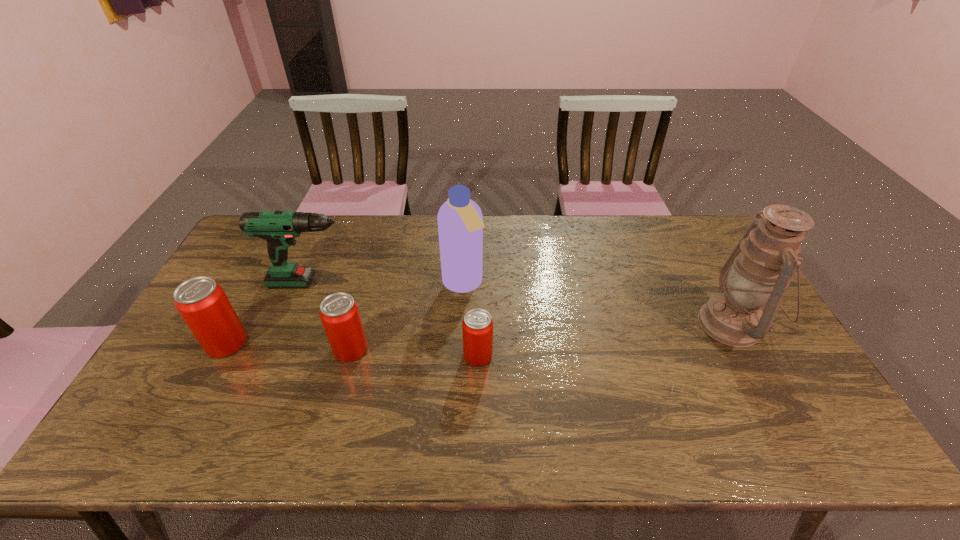
Locate which object is the closest to the second tallest object. Please provide its 2D coordinates. Your answer should be formatted as a tuple, i.e. [(x, y)], where the tuple contains the x and y coordinates of a point satisfying the conditions above.

[(477, 327)]

Identify which can is the second closest to the second can from left to right. Please provide its 2D coordinates. Your answer should be formatted as a tuple, i.e. [(x, y)], where the tuple contains the x and y coordinates of a point satisfying the conditions above.

[(477, 327)]

Select which can appears as the second closest to the shortest object. Please provide its 2D coordinates. Your answer should be formatted as a tuple, i.e. [(x, y)], where the tuple contains the x and y coordinates of a point satisfying the conditions above.

[(202, 303)]

Find the location of `free space that satisfies the following two spatial constraints: 1. on the back side of the leftmost can; 2. on the left side of the rightmost object`. free space that satisfies the following two spatial constraints: 1. on the back side of the leftmost can; 2. on the left side of the rightmost object is located at coordinates (237, 324).

This screenshot has height=540, width=960. What are the coordinates of `free space that satisfies the following two spatial constraints: 1. on the handle side of the shortest can; 2. on the left side of the third tallest object` in the screenshot? It's located at [290, 356].

Identify the location of free location that satisfies the following two spatial constraints: 1. on the handle side of the third tallest object; 2. on the front side of the leftmost can. pos(295,343).

Where is `free region that satisfies the following two spatial constraints: 1. on the handle side of the second tallest object; 2. on the left side of the third tallest object`? free region that satisfies the following two spatial constraints: 1. on the handle side of the second tallest object; 2. on the left side of the third tallest object is located at coordinates (317, 285).

The height and width of the screenshot is (540, 960). Identify the location of free space that satisfies the following two spatial constraints: 1. on the handle side of the second can from right to left; 2. on the right side of the drill. (292, 349).

Locate an element on the screen. The height and width of the screenshot is (540, 960). free location that satisfies the following two spatial constraints: 1. on the handle side of the shampoo; 2. on the left side of the third tallest object is located at coordinates (317, 285).